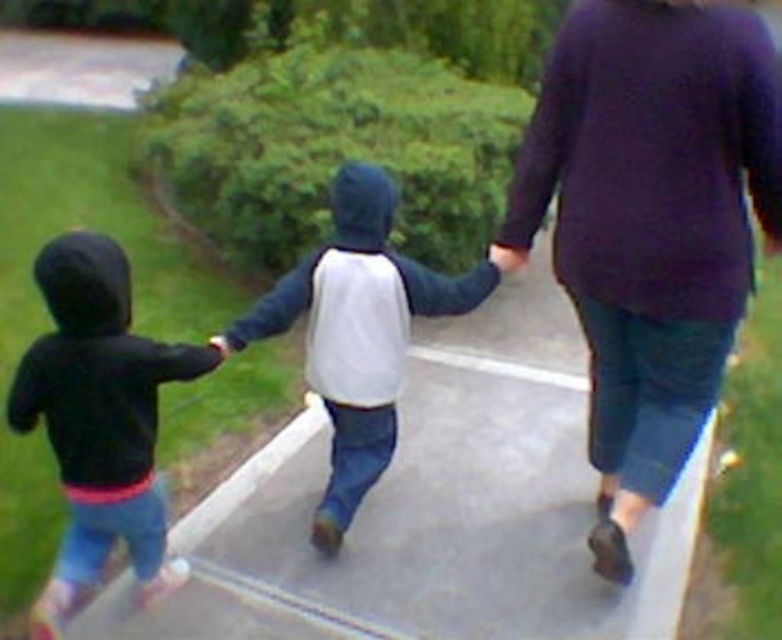
Question: Can you confirm if white concrete pavement at center is positioned below matte black hoodie at left?

Choices:
 (A) yes
 (B) no

Answer: (A)

Question: Which is farther from the purple sweater at upper right?

Choices:
 (A) white concrete pavement at center
 (B) white matte hoodie at center

Answer: (A)

Question: Does white concrete pavement at center have a larger size compared to purple sweater at upper right?

Choices:
 (A) yes
 (B) no

Answer: (A)

Question: Which point appears farthest from the camera in this image?

Choices:
 (A) (522, 253)
 (B) (381, 456)
 (C) (117, 524)
 (D) (415, 497)

Answer: (D)

Question: Does white concrete pavement at center appear over white matte hoodie at center?

Choices:
 (A) no
 (B) yes

Answer: (A)

Question: Which is farther from the matte black hoodie at left?

Choices:
 (A) white concrete pavement at center
 (B) purple sweater at upper right
 (C) matte purple sweater at upper right
 (D) white matte hoodie at center

Answer: (B)